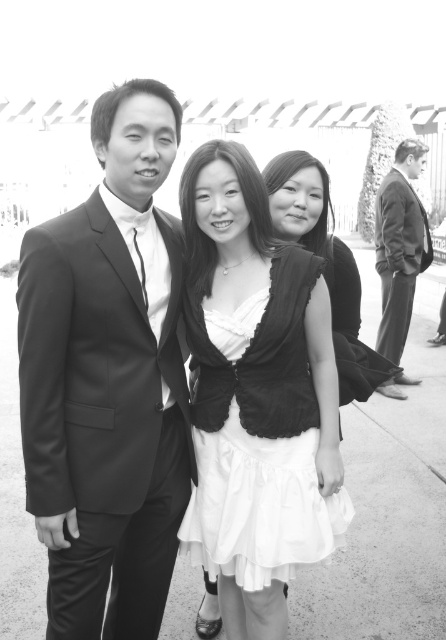
This screenshot has width=446, height=640. What do you see at coordinates (260, 360) in the screenshot?
I see `white satin dress at center` at bounding box center [260, 360].

Does white satin dress at center have a smaller size compared to matte black dress at center?

Indeed, white satin dress at center has a smaller size compared to matte black dress at center.

Looking at this image, who is more distant from viewer, (202, 376) or (359, 321)?

Point (359, 321)

Where is `white satin dress at center`? The width and height of the screenshot is (446, 640). white satin dress at center is located at coordinates (260, 360).

Which of these two, smooth black suit at left or dark suit at right, stands shorter?

Standing shorter between the two is smooth black suit at left.

Does smooth black suit at left have a lesser width compared to dark suit at right?

No.

The image size is (446, 640). What do you see at coordinates (107, 380) in the screenshot? I see `smooth black suit at left` at bounding box center [107, 380].

Identify the location of smooth black suit at left. (107, 380).

Measure the distance between matte black dress at center and dark suit at right.

matte black dress at center and dark suit at right are 13.36 feet apart from each other.

Is matte black dress at center smaller than dark suit at right?

Indeed, matte black dress at center has a smaller size compared to dark suit at right.

Is point (298, 220) less distant than point (404, 276)?

Yes, point (298, 220) is closer to viewer.

Where is `matte black dress at center`? The image size is (446, 640). matte black dress at center is located at coordinates (326, 266).